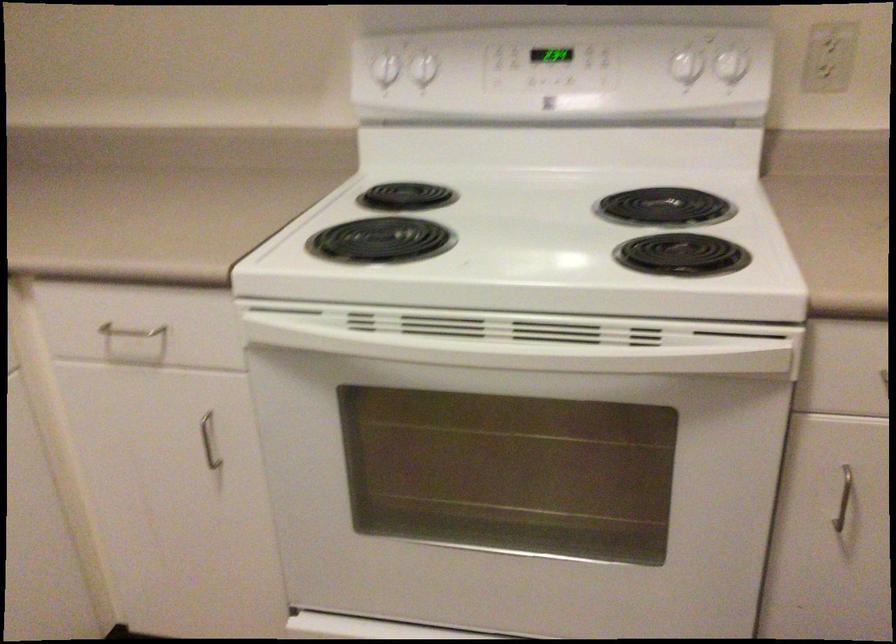
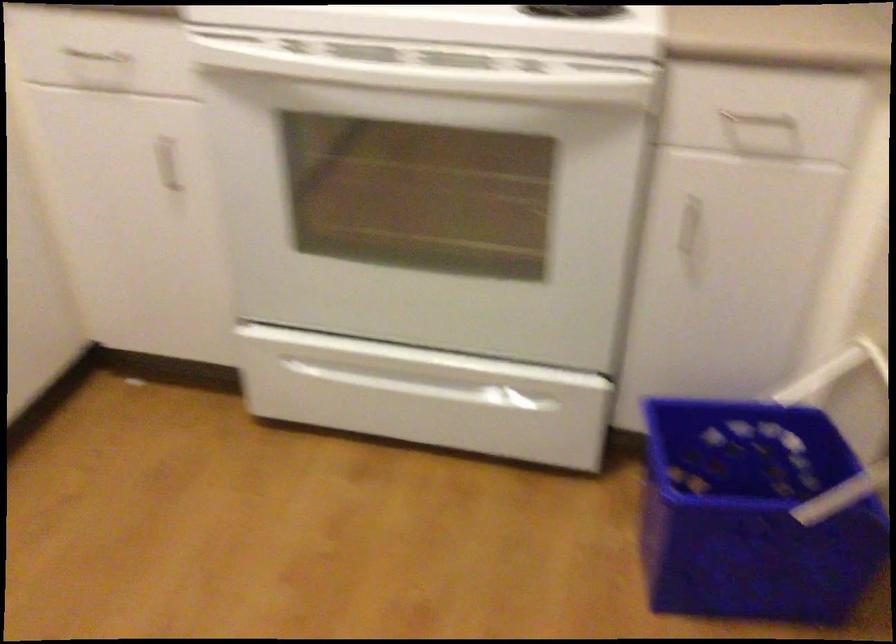
Locate, in the second image, the point that corresponds to the point at 529,345 in the first image.

(437, 77)